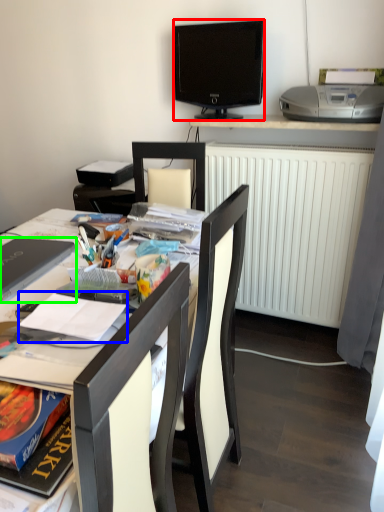
Question: Estimate the real-world distances between objects in this image. Which object is closer to television (highlighted by a red box), magazine (highlighted by a blue box) or laptop (highlighted by a green box)?

Choices:
 (A) magazine
 (B) laptop

Answer: (B)